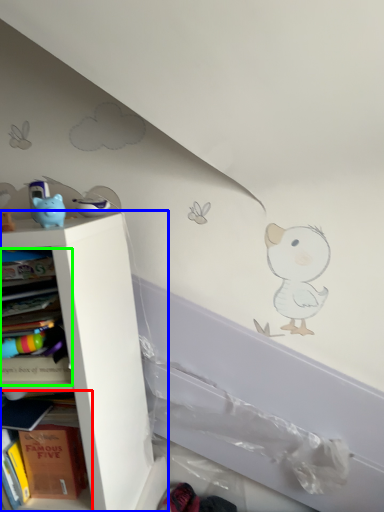
Question: Which is farther away from shelf (highlighted by a red box)? shelf (highlighted by a blue box) or book (highlighted by a green box)?

Choices:
 (A) shelf
 (B) book

Answer: (A)